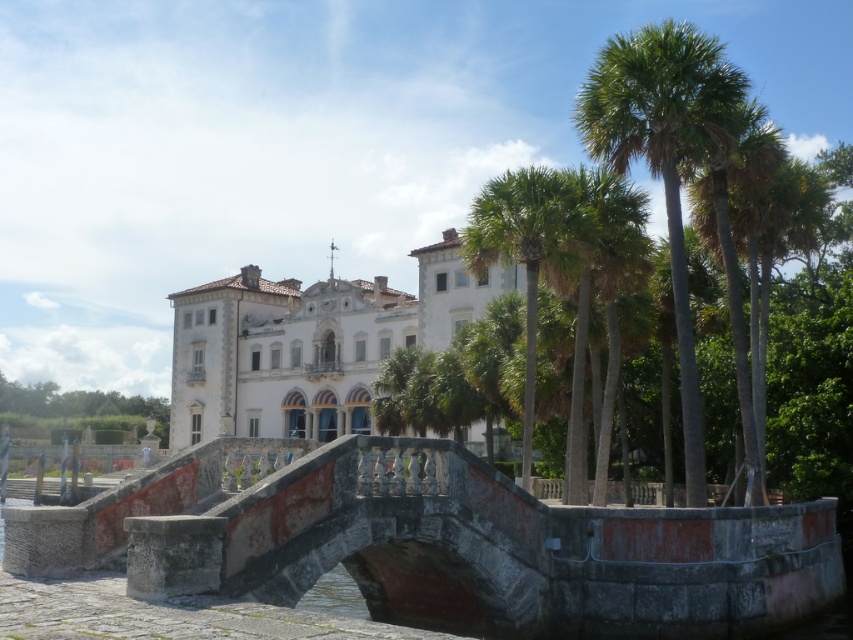
Question: Among these objects, which one is nearest to the camera?

Choices:
 (A) green leafy palm tree at center
 (B) rustic stone bridge at center
 (C) white stone palace at center
 (D) green leafy tree at left

Answer: (B)

Question: Based on their relative distances, which object is farther from the white stone palace at center?

Choices:
 (A) green leafy palm tree at center
 (B) green leafy tree at left
 (C) green leafy palm trees at right
 (D) rustic stone bridge at center

Answer: (D)

Question: Can you confirm if rustic stone bridge at center is positioned above white stone palace at center?

Choices:
 (A) yes
 (B) no

Answer: (B)

Question: Is white stone palace at center closer to camera compared to green leafy palm tree at center?

Choices:
 (A) yes
 (B) no

Answer: (B)

Question: Is rustic stone bridge at center positioned in front of white stone palace at center?

Choices:
 (A) no
 (B) yes

Answer: (B)

Question: Which point is closer to the camera?

Choices:
 (A) (630, 637)
 (B) (409, 307)
 (C) (9, 385)

Answer: (A)